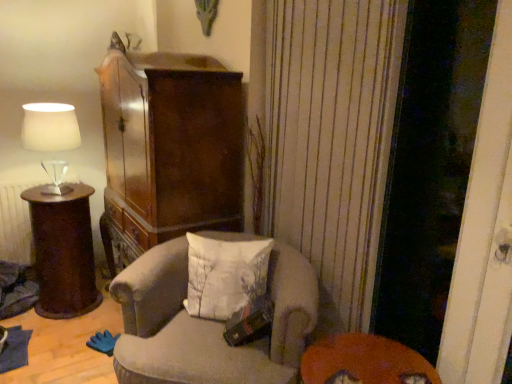
Question: Is point (59, 140) closer or farther from the camera than point (150, 266)?

Choices:
 (A) farther
 (B) closer

Answer: (A)

Question: Would you say white fabric lampshade at left is to the left or to the right of velvet beige armchair at center in the picture?

Choices:
 (A) left
 (B) right

Answer: (A)

Question: Estimate the real-world distances between objects in this image. Which object is farther from the velvet beige armchair at center?

Choices:
 (A) orange felt table at lower right
 (B) white fabric pillow at center
 (C) transparent glass screen door at right
 (D) dark brown polished wood side table at left
 (E) white fabric lampshade at left

Answer: (E)

Question: Based on their relative distances, which object is nearer to the orange felt table at lower right?

Choices:
 (A) velvet beige armchair at center
 (B) white fabric lampshade at left
 (C) transparent glass screen door at right
 (D) white fabric pillow at center
 (E) dark brown polished wood side table at left

Answer: (A)